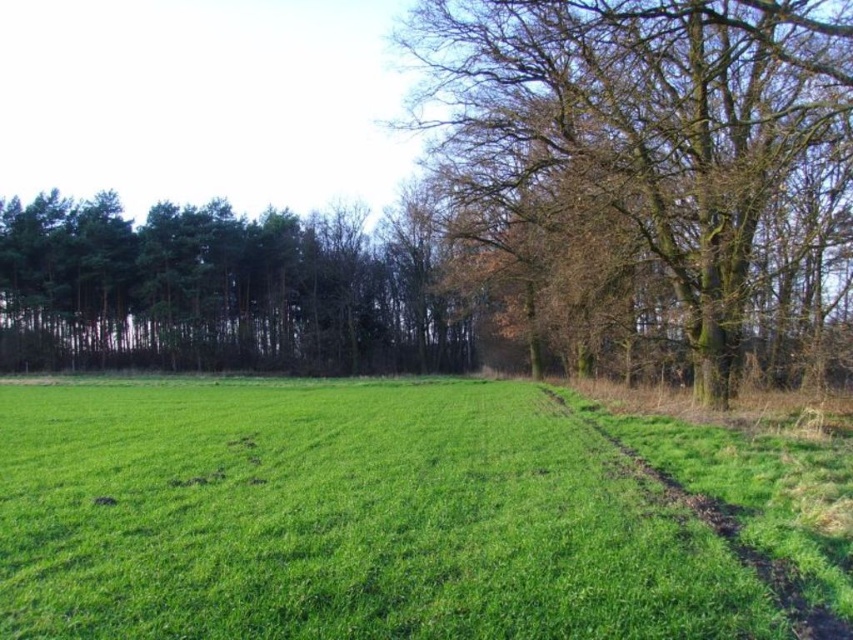
Question: Does green grass at center come behind green grassy path at right?

Choices:
 (A) yes
 (B) no

Answer: (B)

Question: Which of the following is the closest to the observer?

Choices:
 (A) green grassy path at right
 (B) green grass at center
 (C) green leafy trees at left
 (D) brown rough bark tree at upper right

Answer: (B)

Question: Which point is farther from the camera taking this photo?

Choices:
 (A) (764, 4)
 (B) (209, 381)
 (C) (849, 636)

Answer: (B)

Question: Is green leafy trees at left positioned before green grassy path at right?

Choices:
 (A) no
 (B) yes

Answer: (A)

Question: Among these points, which one is nearest to the camera?

Choices:
 (A) (610, 436)
 (B) (137, 342)
 (C) (695, 486)

Answer: (C)

Question: Can you confirm if green grass at center is thinner than green grassy path at right?

Choices:
 (A) no
 (B) yes

Answer: (A)